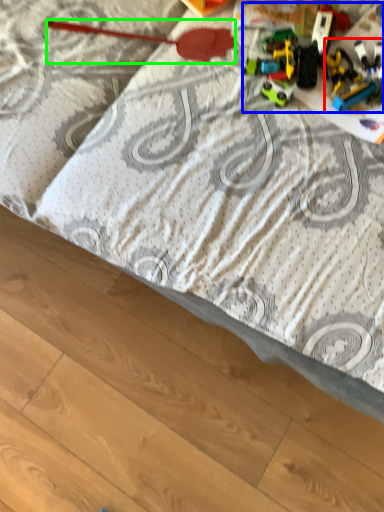
Question: Which is nearer to the toy (highlighted by a red box)? toy (highlighted by a blue box) or toy (highlighted by a green box).

Choices:
 (A) toy
 (B) toy

Answer: (A)